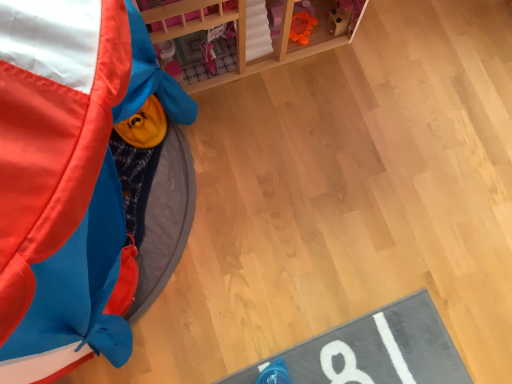
Question: Considering the relative sizes of wooden dollhouse at upper center and rubberized yellow toy at upper left in the image provided, is wooden dollhouse at upper center wider than rubberized yellow toy at upper left?

Choices:
 (A) no
 (B) yes

Answer: (A)

Question: Is wooden dollhouse at upper center with rubberized yellow toy at upper left?

Choices:
 (A) no
 (B) yes

Answer: (A)

Question: From a real-world perspective, is wooden dollhouse at upper center located higher than rubberized yellow toy at upper left?

Choices:
 (A) yes
 (B) no

Answer: (B)

Question: From the image's perspective, would you say wooden dollhouse at upper center is shown under rubberized yellow toy at upper left?

Choices:
 (A) no
 (B) yes

Answer: (A)

Question: Is wooden dollhouse at upper center smaller than rubberized yellow toy at upper left?

Choices:
 (A) yes
 (B) no

Answer: (A)

Question: From a real-world perspective, does wooden dollhouse at upper center sit lower than rubberized yellow toy at upper left?

Choices:
 (A) no
 (B) yes

Answer: (B)

Question: Can you confirm if rubberized yellow toy at upper left is wider than wooden dollhouse at upper center?

Choices:
 (A) no
 (B) yes

Answer: (B)

Question: Is rubberized yellow toy at upper left closer to the viewer compared to wooden dollhouse at upper center?

Choices:
 (A) no
 (B) yes

Answer: (B)

Question: Is rubberized yellow toy at upper left placed right next to wooden dollhouse at upper center?

Choices:
 (A) yes
 (B) no

Answer: (B)

Question: Considering the relative sizes of rubberized yellow toy at upper left and wooden dollhouse at upper center in the image provided, is rubberized yellow toy at upper left shorter than wooden dollhouse at upper center?

Choices:
 (A) no
 (B) yes

Answer: (A)

Question: Is rubberized yellow toy at upper left positioned far away from wooden dollhouse at upper center?

Choices:
 (A) no
 (B) yes

Answer: (A)

Question: Is wooden dollhouse at upper center located within rubberized yellow toy at upper left?

Choices:
 (A) yes
 (B) no

Answer: (B)

Question: Is wooden dollhouse at upper center in front of or behind rubberized yellow toy at upper left in the image?

Choices:
 (A) behind
 (B) front

Answer: (A)